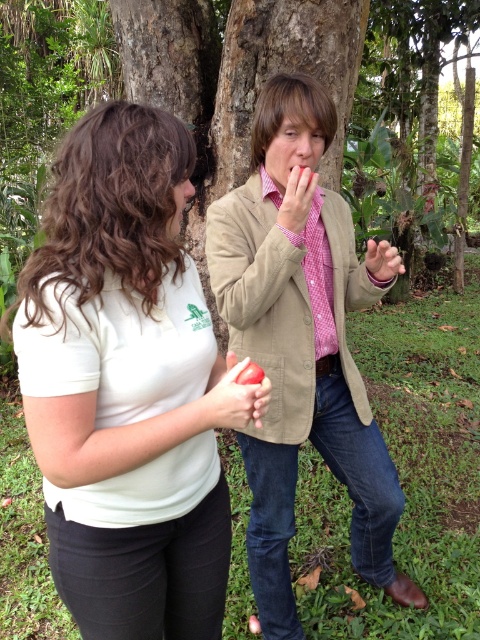
Question: Which object is positioned closest to the pink checkered shirt at center?

Choices:
 (A) matte red apple at center
 (B) pink dotted fabric tie at center

Answer: (B)

Question: Is matte red apple at center behind matte pink shirt at upper center?

Choices:
 (A) yes
 (B) no

Answer: (B)

Question: Which of these objects is positioned closest to the white matte shirt at center?

Choices:
 (A) matte pink shirt at center
 (B) matte red apple at center
 (C) matte pink shirt at upper center

Answer: (B)

Question: Can you confirm if white matte shirt at center is wider than pink dotted fabric tie at center?

Choices:
 (A) no
 (B) yes

Answer: (B)

Question: Is the position of white matte shirt at center more distant than that of matte red apple at center?

Choices:
 (A) no
 (B) yes

Answer: (A)

Question: Among these objects, which one is nearest to the camera?

Choices:
 (A) white matte shirt at center
 (B) matte pink shirt at upper center

Answer: (A)